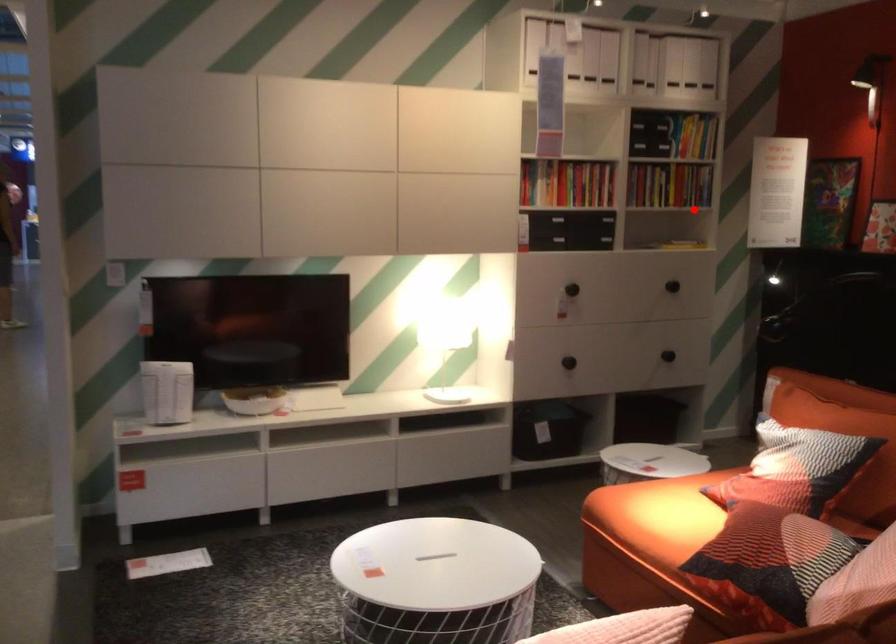
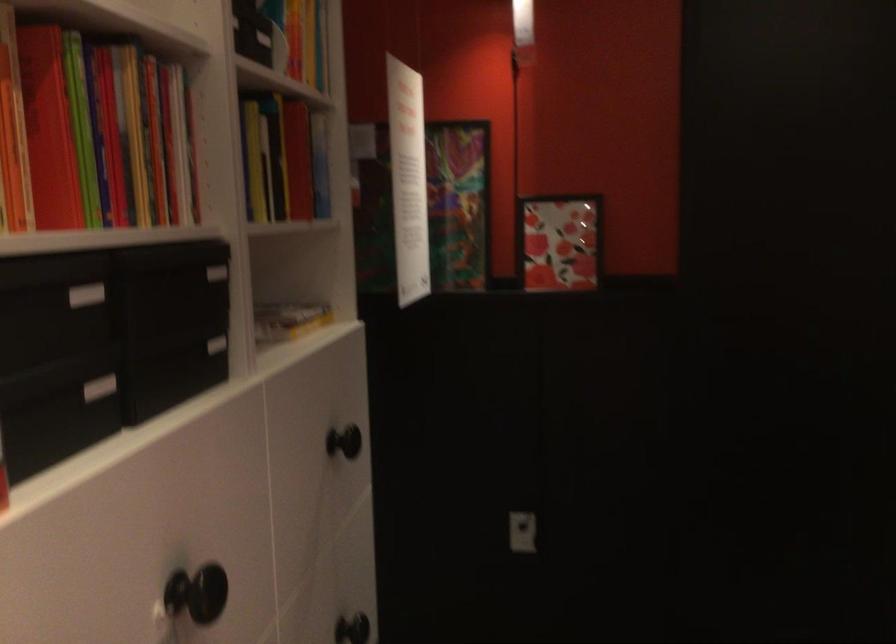
Question: I am providing you with two images of the same scene from different viewpoints. A red point is shown in image1. For the corresponding object point in image2, is it positioned nearer or farther from the camera?

Choices:
 (A) Nearer
 (B) Farther

Answer: (A)